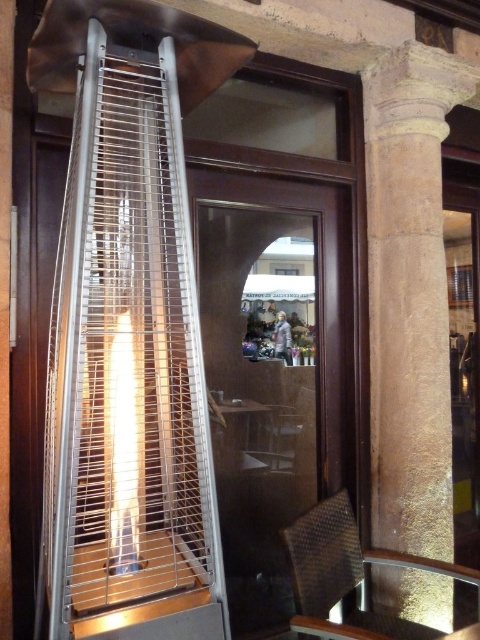
Question: Does stone column at right appear over metallic woven chair at lower right?

Choices:
 (A) yes
 (B) no

Answer: (A)

Question: Does metallic wire birdcage at left have a smaller size compared to stone column at right?

Choices:
 (A) no
 (B) yes

Answer: (A)

Question: Which point is farther to the camera?

Choices:
 (A) click(118, 353)
 (B) click(387, 532)
 (C) click(348, 584)

Answer: (B)

Question: Which point appears closest to the camera in this image?

Choices:
 (A) click(396, 74)
 (B) click(339, 566)
 (C) click(178, 260)

Answer: (C)

Question: Which object is the closest to the metallic woven chair at lower right?

Choices:
 (A) stone column at right
 (B) metallic wire birdcage at left

Answer: (A)

Question: Does stone column at right have a greater width compared to metallic woven chair at lower right?

Choices:
 (A) no
 (B) yes

Answer: (A)